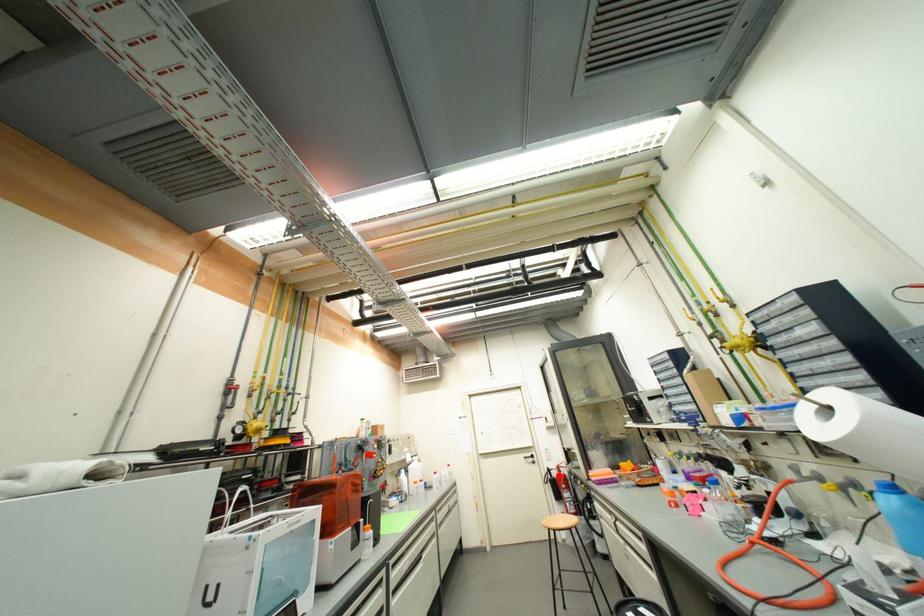
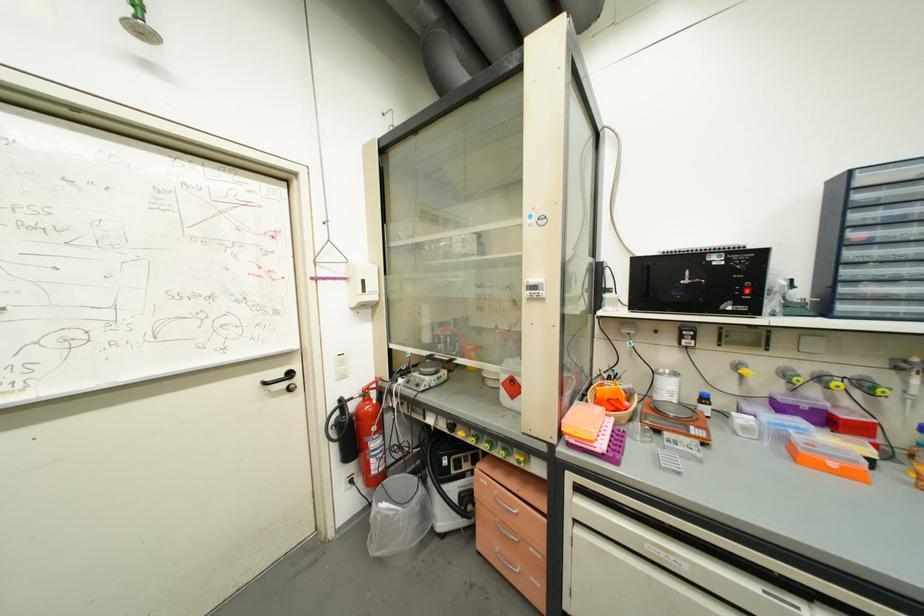
Find the pixel in the second image that matches the highlighted location in the first image.

(358, 408)